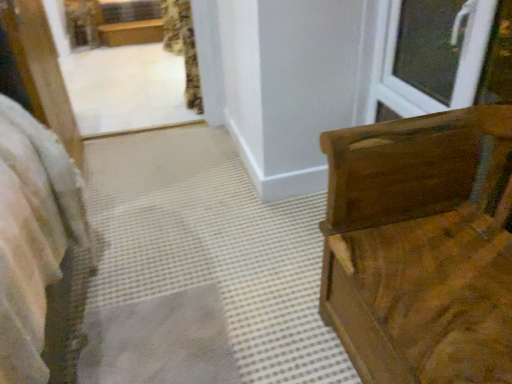
Question: From the image's perspective, is white plastic window at upper right under floral fabric curtain at upper center?

Choices:
 (A) yes
 (B) no

Answer: (A)

Question: Can you confirm if white plastic window at upper right is thinner than floral fabric curtain at upper center?

Choices:
 (A) no
 (B) yes

Answer: (B)

Question: Is white plastic window at upper right not within floral fabric curtain at upper center?

Choices:
 (A) yes
 (B) no

Answer: (A)

Question: Is white plastic window at upper right facing towards floral fabric curtain at upper center?

Choices:
 (A) yes
 (B) no

Answer: (B)

Question: Is white plastic window at upper right shorter than floral fabric curtain at upper center?

Choices:
 (A) yes
 (B) no

Answer: (A)

Question: Is wooden chest at right spatially inside floral fabric curtain at upper center, or outside of it?

Choices:
 (A) inside
 (B) outside

Answer: (B)

Question: From a real-world perspective, is wooden chest at right above or below floral fabric curtain at upper center?

Choices:
 (A) below
 (B) above

Answer: (A)

Question: Considering the positions of point (x=345, y=132) and point (x=161, y=6), is point (x=345, y=132) closer or farther from the camera than point (x=161, y=6)?

Choices:
 (A) closer
 (B) farther

Answer: (A)

Question: In terms of height, does wooden chest at right look taller or shorter compared to floral fabric curtain at upper center?

Choices:
 (A) short
 (B) tall

Answer: (B)

Question: Is white plastic window at upper right wider or thinner than wooden chest at right?

Choices:
 (A) wide
 (B) thin

Answer: (B)

Question: Is white plastic window at upper right inside the boundaries of wooden chest at right, or outside?

Choices:
 (A) outside
 (B) inside

Answer: (A)

Question: From a real-world perspective, relative to wooden chest at right, is white plastic window at upper right vertically above or below?

Choices:
 (A) below
 (B) above

Answer: (B)

Question: Is white plastic window at upper right in front of or behind wooden chest at right in the image?

Choices:
 (A) front
 (B) behind

Answer: (B)

Question: Relative to wooden chest at right, is floral fabric curtain at upper center in front or behind?

Choices:
 (A) front
 (B) behind

Answer: (B)

Question: Is point (x=180, y=4) positioned closer to the camera than point (x=404, y=215)?

Choices:
 (A) farther
 (B) closer

Answer: (A)